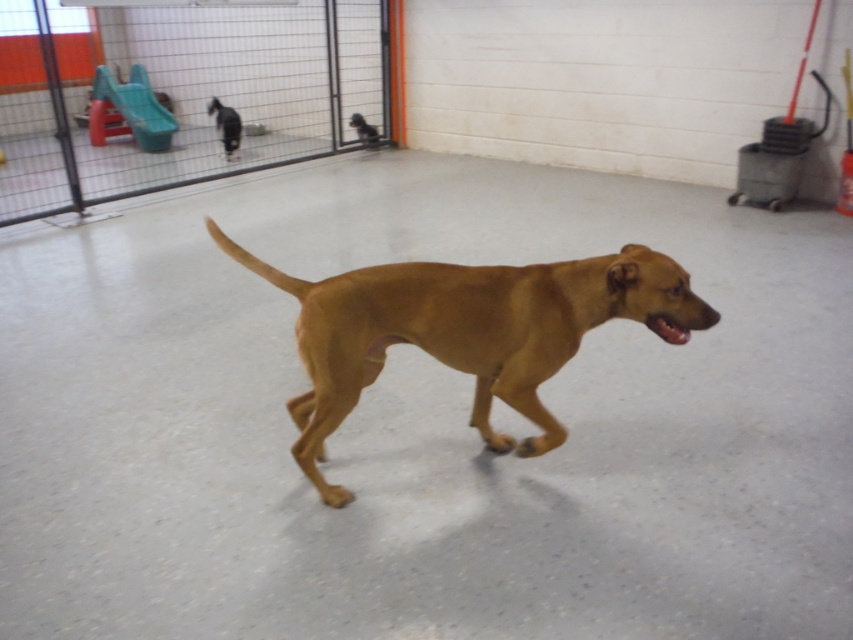
Can you confirm if shiny black dog at upper left is positioned to the left of brown matte dog at center?

Correct, you'll find shiny black dog at upper left to the left of brown matte dog at center.

From the picture: Is shiny black dog at upper left below brown matte dog at center?

No, shiny black dog at upper left is not below brown matte dog at center.

Between point (231, 145) and point (363, 140), which one is positioned in front?

Positioned in front is point (231, 145).

Identify the location of shiny black dog at upper left. This screenshot has width=853, height=640. (225, 125).

Who is taller, golden brown fur at center or shiny black dog at upper left?

golden brown fur at center is taller.

Does golden brown fur at center come behind shiny black dog at upper left?

No, it is in front of shiny black dog at upper left.

Locate an element on the screen. The image size is (853, 640). golden brown fur at center is located at coordinates (466, 332).

How far apart are golden brown fur at center and brown matte dog at center?

golden brown fur at center is 5.04 meters away from brown matte dog at center.

Which is more to the right, golden brown fur at center or brown matte dog at center?

Positioned to the right is golden brown fur at center.

Identify the location of golden brown fur at center. (466, 332).